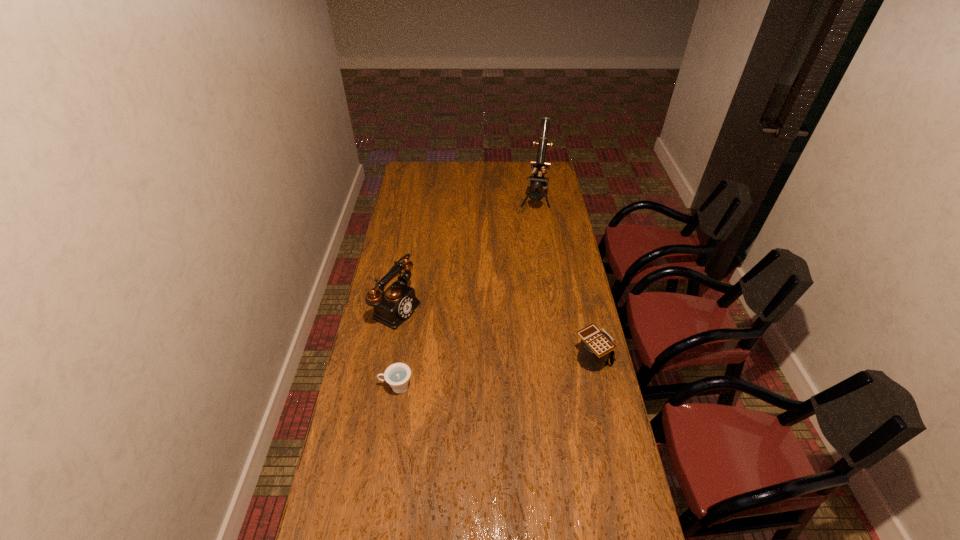
Locate an element on the screen. free space in the image that satisfies the following two spatial constraints: 1. on the front side of the third tallest object; 2. on the left side of the microscope is located at coordinates (559, 359).